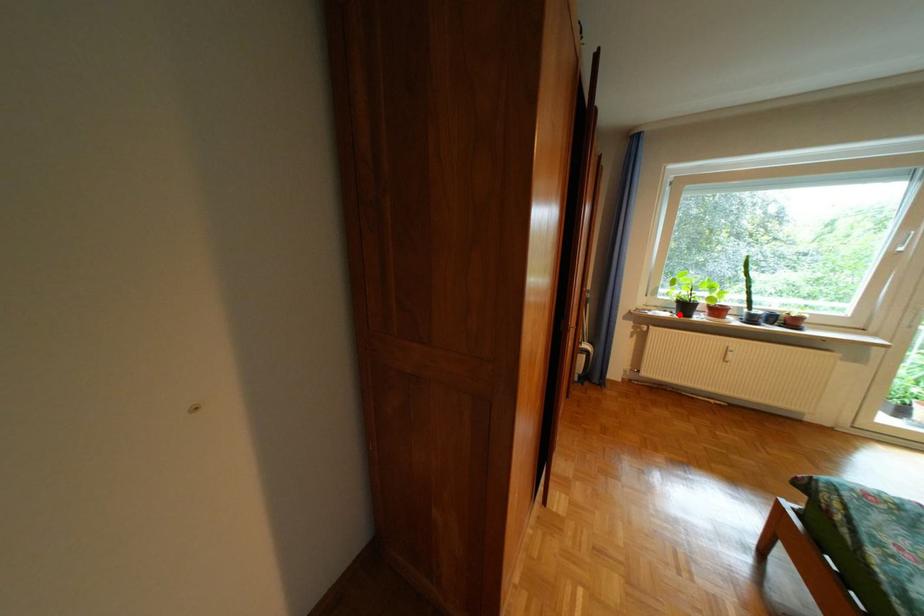
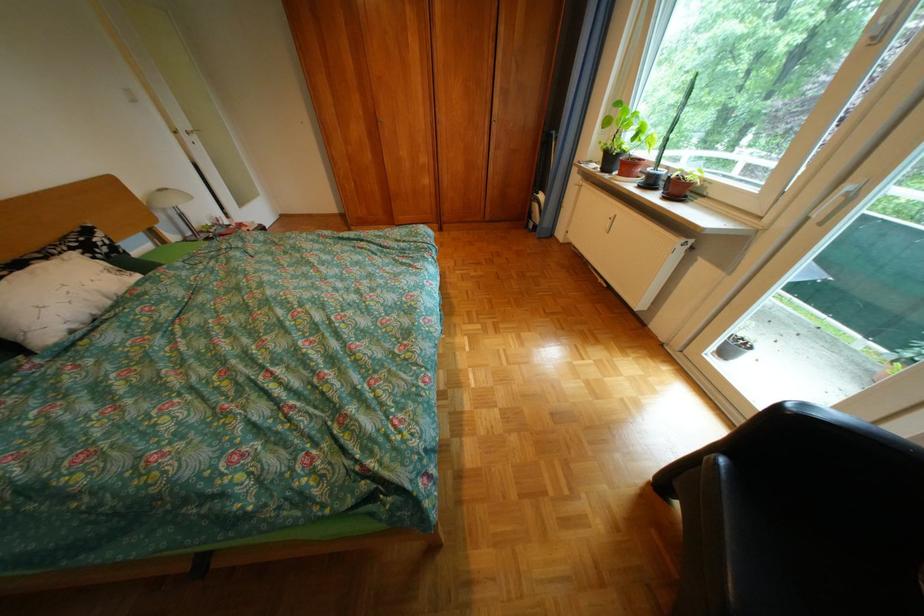
Question: I am providing you with two images of the same scene from different viewpoints. Image1 has a red point marked. In image2, the corresponding 3D location appears at what relative position? Reply with the corresponding letter.

Choices:
 (A) Closer
 (B) Farther

Answer: (A)